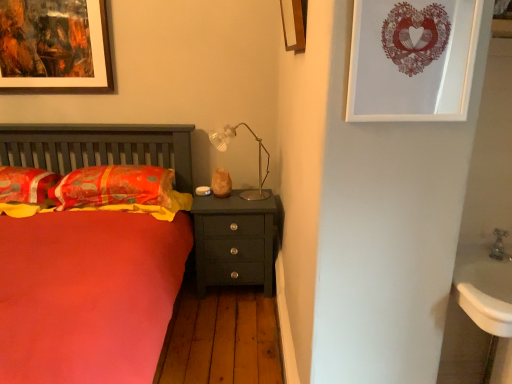
Question: Is metallic silver faucet at lower right oriented towards wooden framed artwork at upper left, which is the 3th picture frame from right to left?

Choices:
 (A) no
 (B) yes

Answer: (A)

Question: Is metallic silver faucet at lower right shorter than wooden framed artwork at upper left, the 1th picture frame from the left?

Choices:
 (A) no
 (B) yes

Answer: (B)

Question: Is the depth of metallic silver faucet at lower right less than that of wooden framed artwork at upper left, which is the 3th picture frame in front-to-back order?

Choices:
 (A) yes
 (B) no

Answer: (A)

Question: Does metallic silver faucet at lower right appear on the right side of wooden framed artwork at upper left, which is the 3th picture frame from right to left?

Choices:
 (A) no
 (B) yes

Answer: (B)

Question: Does metallic silver faucet at lower right have a greater height compared to wooden framed artwork at upper left, which is the 3th picture frame from right to left?

Choices:
 (A) no
 (B) yes

Answer: (A)

Question: Can you confirm if metallic silver faucet at lower right is positioned to the left of wooden framed artwork at upper left, which is counted as the 1th picture frame, starting from the back?

Choices:
 (A) no
 (B) yes

Answer: (A)

Question: Would you say velvety orange pillow at left, which ranks as the 2th pillow in left-to-right order, contains matte paper picture frame at upper right, which appears as the 1th picture frame when viewed from the front?

Choices:
 (A) yes
 (B) no

Answer: (B)

Question: Does velvety orange pillow at left, which ranks as the 2th pillow in left-to-right order, turn towards matte paper picture frame at upper right, which is the third picture frame from back to front?

Choices:
 (A) no
 (B) yes

Answer: (A)

Question: From a real-world perspective, is velvety orange pillow at left, the 1th pillow positioned from the right, positioned over matte paper picture frame at upper right, which ranks as the third picture frame in left-to-right order, based on gravity?

Choices:
 (A) no
 (B) yes

Answer: (A)

Question: Is velvety orange pillow at left, which ranks as the 2th pillow in left-to-right order, touching matte paper picture frame at upper right, which ranks as the third picture frame in left-to-right order?

Choices:
 (A) yes
 (B) no

Answer: (B)

Question: Does velvety orange pillow at left, the 1th pillow positioned from the right, appear on the left side of matte paper picture frame at upper right, which ranks as the third picture frame in left-to-right order?

Choices:
 (A) yes
 (B) no

Answer: (A)

Question: Considering the relative sizes of velvety orange pillow at left, which ranks as the 2th pillow in left-to-right order, and matte paper picture frame at upper right, which appears as the 1th picture frame when viewed from the front, in the image provided, is velvety orange pillow at left, which ranks as the 2th pillow in left-to-right order, smaller than matte paper picture frame at upper right, which appears as the 1th picture frame when viewed from the front,?

Choices:
 (A) yes
 (B) no

Answer: (B)

Question: Considering the relative sizes of matte orange pillow at left, which is the 2th pillow from right to left, and matte dark green nightstand at center in the image provided, is matte orange pillow at left, which is the 2th pillow from right to left, taller than matte dark green nightstand at center?

Choices:
 (A) no
 (B) yes

Answer: (A)